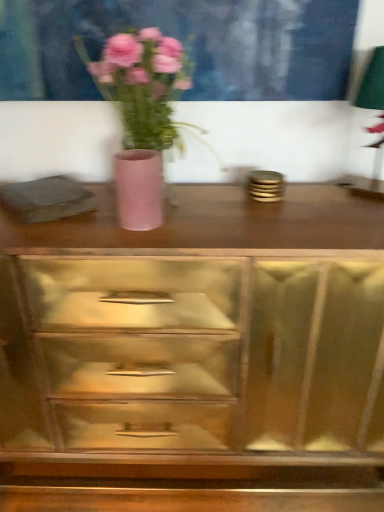
Question: Should I look upward or downward to see pink matte vase at center?

Choices:
 (A) down
 (B) up

Answer: (B)

Question: Is wooden chest of drawers at center further to camera compared to pink matte vase at center?

Choices:
 (A) yes
 (B) no

Answer: (A)

Question: Can you confirm if wooden chest of drawers at center is smaller than pink matte vase at center?

Choices:
 (A) no
 (B) yes

Answer: (A)

Question: Does wooden chest of drawers at center touch pink matte vase at center?

Choices:
 (A) no
 (B) yes

Answer: (A)

Question: From a real-world perspective, does wooden chest of drawers at center sit lower than pink matte vase at center?

Choices:
 (A) yes
 (B) no

Answer: (A)

Question: Can you confirm if wooden chest of drawers at center is thinner than pink matte vase at center?

Choices:
 (A) yes
 (B) no

Answer: (B)

Question: Can you confirm if wooden chest of drawers at center is positioned to the left of pink matte vase at center?

Choices:
 (A) yes
 (B) no

Answer: (B)

Question: Is the position of pink matte vase at center more distant than that of matte pink vase at center?

Choices:
 (A) no
 (B) yes

Answer: (A)

Question: Is matte pink vase at center a part of pink matte vase at center?

Choices:
 (A) yes
 (B) no

Answer: (A)

Question: Can you confirm if pink matte vase at center is shorter than matte pink vase at center?

Choices:
 (A) no
 (B) yes

Answer: (A)

Question: Considering the relative sizes of pink matte vase at center and matte pink vase at center in the image provided, is pink matte vase at center thinner than matte pink vase at center?

Choices:
 (A) no
 (B) yes

Answer: (A)

Question: Does pink matte vase at center have a larger size compared to matte pink vase at center?

Choices:
 (A) no
 (B) yes

Answer: (B)

Question: Would you consider pink matte vase at center to be distant from matte pink vase at center?

Choices:
 (A) no
 (B) yes

Answer: (A)

Question: Could matte pink vase at center be considered to be inside wooden chest of drawers at center?

Choices:
 (A) yes
 (B) no

Answer: (B)